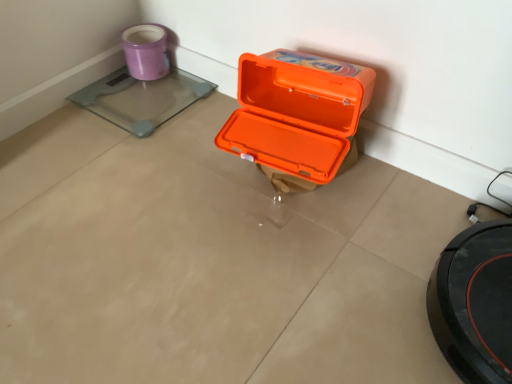
Where is `vacant area situated below transparent glass scale at upper left (from a real-world perspective)`? vacant area situated below transparent glass scale at upper left (from a real-world perspective) is located at coordinates 150,96.